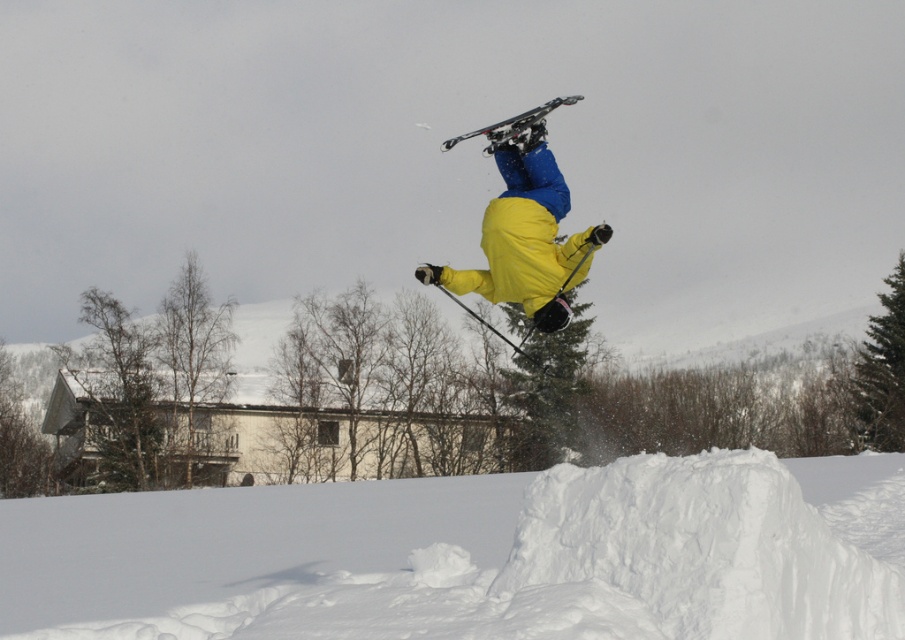
Image resolution: width=905 pixels, height=640 pixels. I want to click on white fluffy snow at center, so click(x=475, y=556).

Is point (639, 612) closer to camera compared to point (534, 216)?

Yes.

Find the location of `white fluffy snow at center`. white fluffy snow at center is located at coordinates (475, 556).